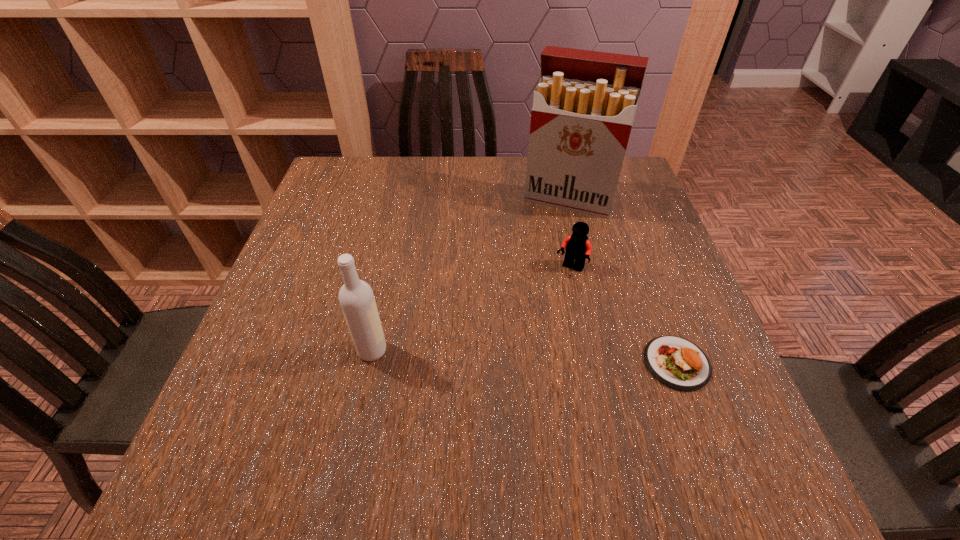
You are a GUI agent. You are given a task and a screenshot of the screen. Output one action in this format:
    pyautogui.click(x=<x>, y=<y>)
    Task: Click on the object that is positioned at the near right corner
    The image size is (960, 540).
    Given the screenshot: What is the action you would take?
    pyautogui.click(x=678, y=363)

Locate an element on the screen. The height and width of the screenshot is (540, 960). free region at the far edge is located at coordinates (409, 160).

You are a GUI agent. You are given a task and a screenshot of the screen. Output one action in this format:
    pyautogui.click(x=<x>, y=<y>)
    Task: Click on the blank space at the left edge of the desktop
    Image resolution: width=960 pixels, height=540 pixels.
    Given the screenshot: What is the action you would take?
    pyautogui.click(x=324, y=253)

At what (x,y) coordinates should I click in order to perform the action: click on vacant space at the right edge of the desktop. Please return your answer as a coordinate pair (x, y). This screenshot has height=540, width=960. Looking at the image, I should click on (636, 326).

In the image, there is a desktop. Where is `vacant space at the far left corner`? vacant space at the far left corner is located at coordinates (329, 174).

What are the coordinates of `vacant space at the far right corner of the desktop` in the screenshot? It's located at (627, 183).

Find the location of a particular element. The image size is (960, 540). free space between the third shortest object and the third nearest object is located at coordinates (471, 310).

I want to click on vacant space in between the farthest object and the patty (food), so click(x=623, y=281).

The width and height of the screenshot is (960, 540). Find the location of `free area in between the shortest object and the leftmost object`. free area in between the shortest object and the leftmost object is located at coordinates (524, 357).

Locate an element on the screen. free point between the Lego and the shortest object is located at coordinates (624, 316).